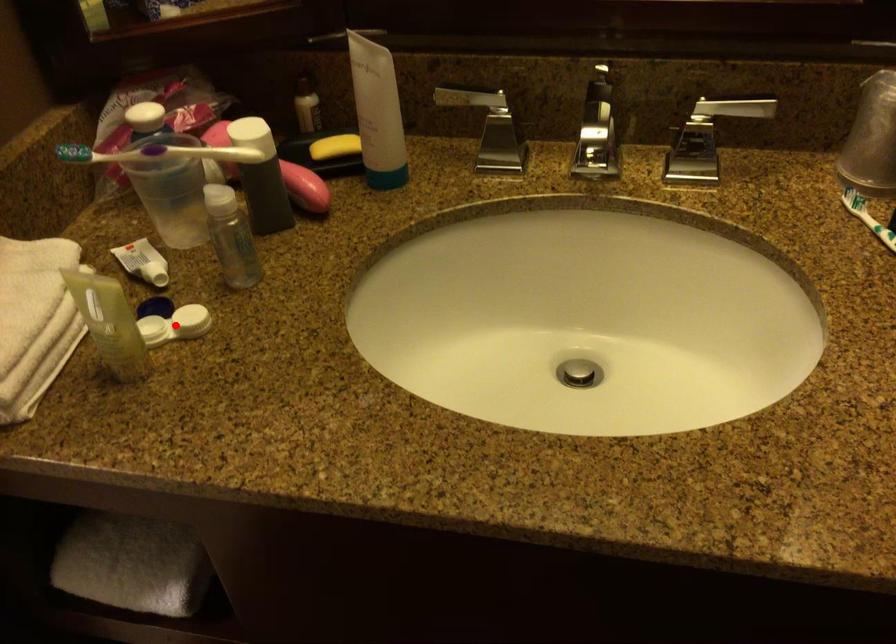
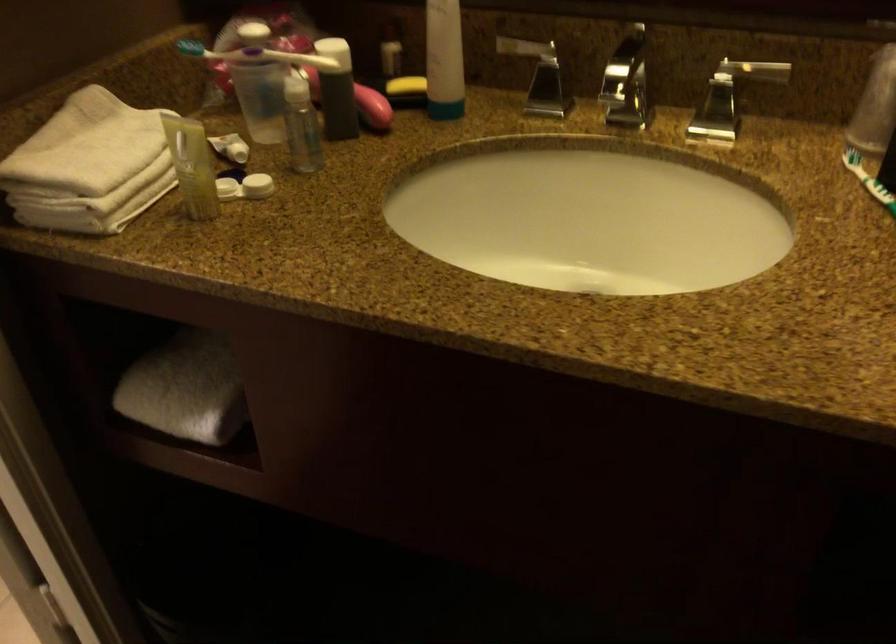
Find the pixel in the second image that matches the highlighted location in the first image.

(245, 187)